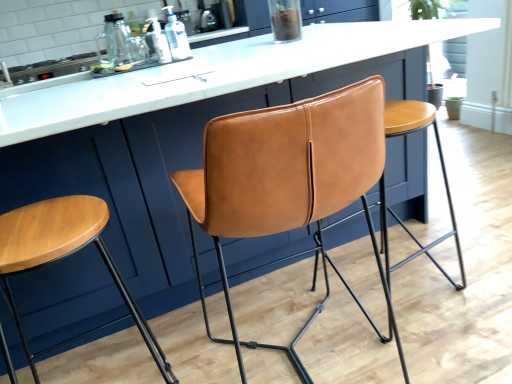
This screenshot has width=512, height=384. Identify the location of vacant area in front of matte leather stool at center, which is the 1th stool in right-to-left order. (453, 344).